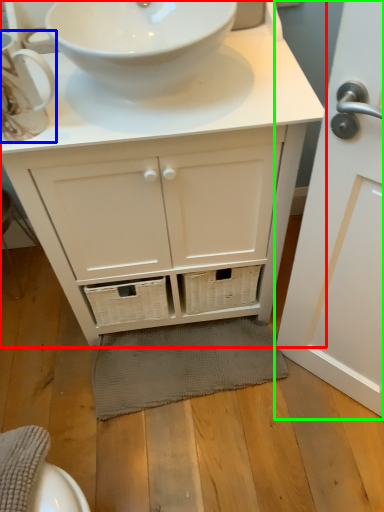
Question: Which is nearer to the bathroom cabinet (highlighted by a red box)? teacup (highlighted by a blue box) or door (highlighted by a green box).

Choices:
 (A) teacup
 (B) door

Answer: (B)